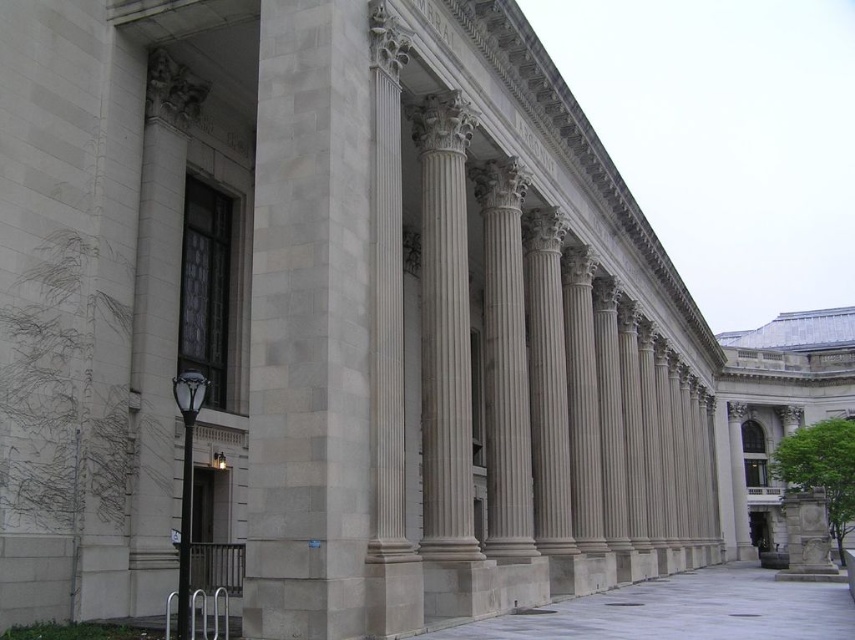
What do you see at coordinates (310, 324) in the screenshot?
I see `white marble column at center` at bounding box center [310, 324].

Who is more distant from viewer, (323, 410) or (746, 609)?

Point (746, 609)

You are a GUI agent. You are given a task and a screenshot of the screen. Output one action in this format:
    pyautogui.click(x=<x>, y=<y>)
    Task: Click on the white marble column at center
    This screenshot has width=855, height=640.
    Given the screenshot: What is the action you would take?
    pyautogui.click(x=310, y=324)